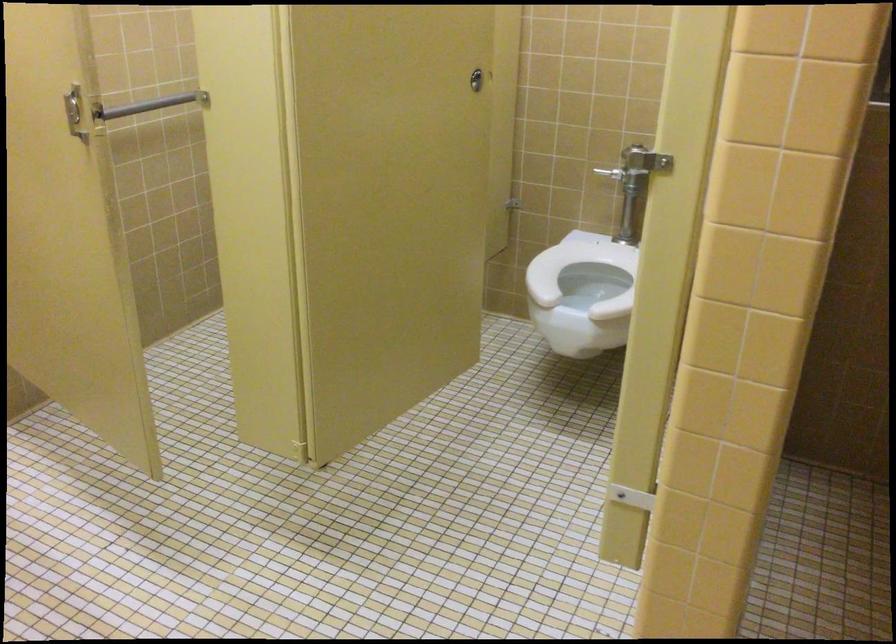
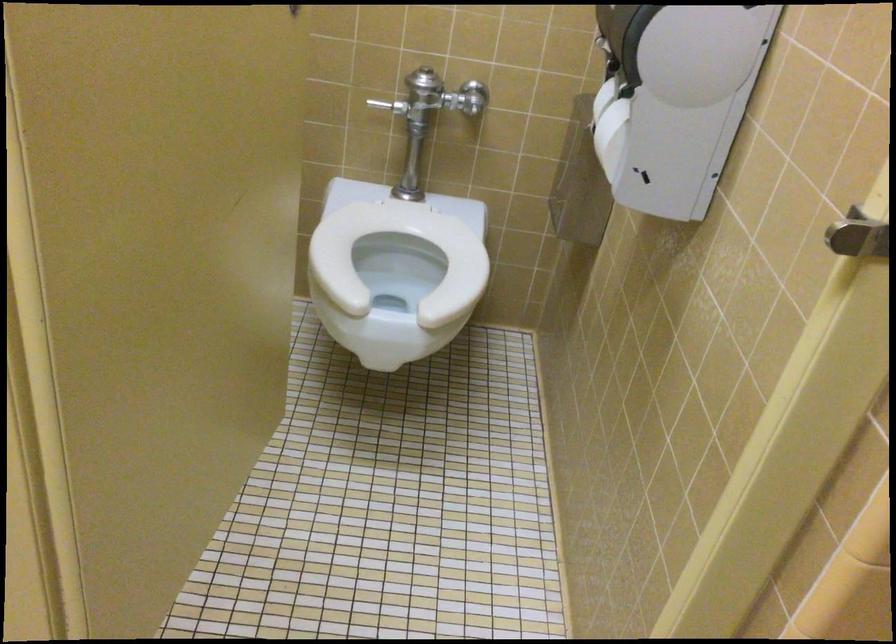
Question: The camera is either moving clockwise (left) or counter-clockwise (right) around the object. The first image is from the beginning of the video and the second image is from the end. Is the camera moving left or right when shooting the video?

Choices:
 (A) Left
 (B) Right

Answer: (A)